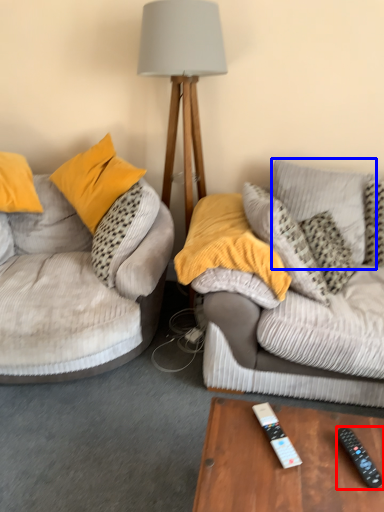
Question: Which object appears farthest to the camera in this image, remote control (highlighted by a red box) or pillow (highlighted by a blue box)?

Choices:
 (A) remote control
 (B) pillow

Answer: (B)